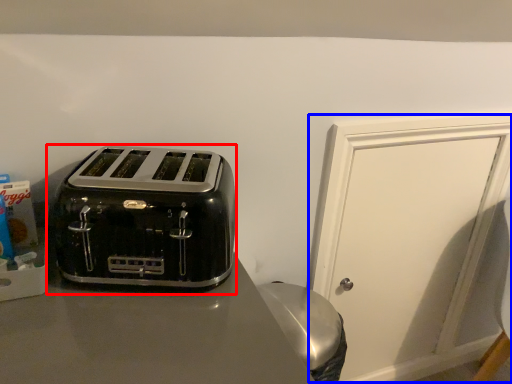
Question: Among these objects, which one is farthest to the camera, toaster (highlighted by a red box) or door (highlighted by a blue box)?

Choices:
 (A) toaster
 (B) door

Answer: (B)